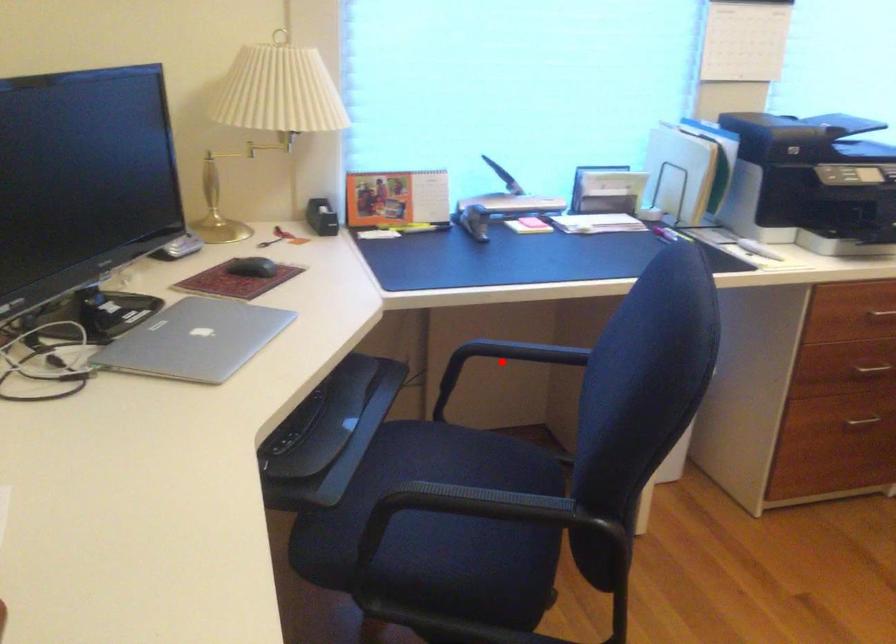
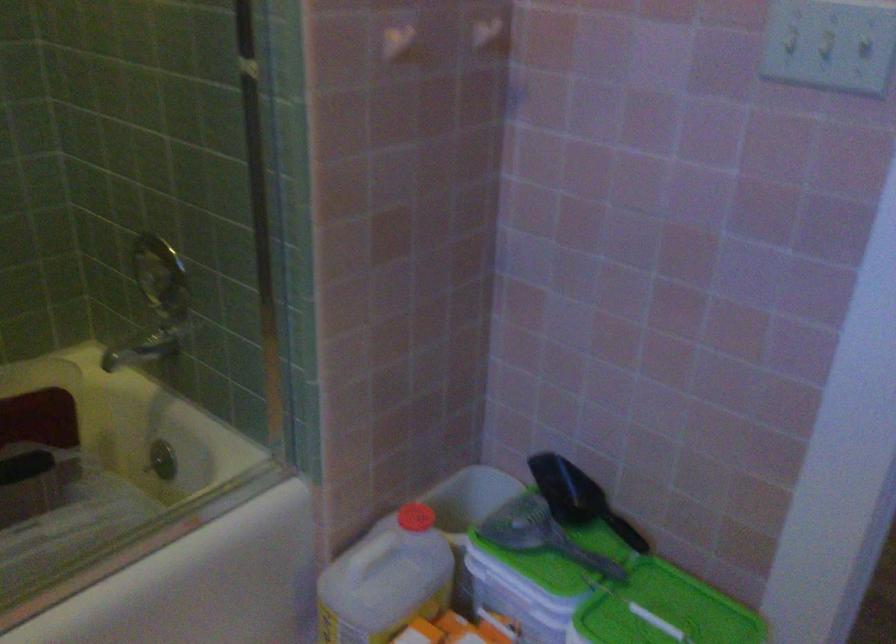
Question: I am providing you with two images of the same scene from different viewpoints. A red point is marked on the first image. Can you still see the location of the red point in image 2?

Choices:
 (A) Yes
 (B) No

Answer: (B)